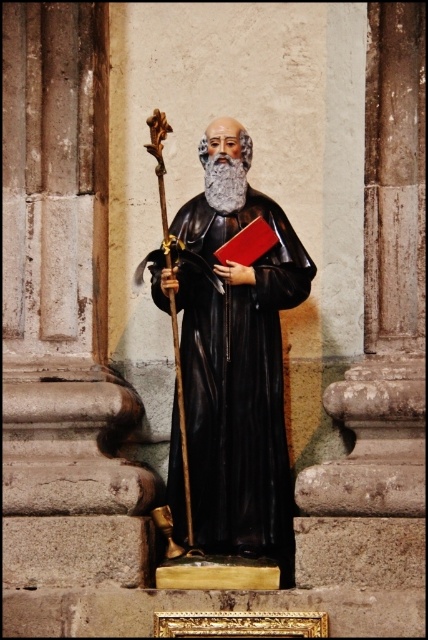
Where is `black glossy statue at center`? black glossy statue at center is located at coordinates (229, 390).

How far apart are black glossy statue at center and graywoollybeard at center?

black glossy statue at center and graywoollybeard at center are 5.21 meters apart from each other.

Does point (234, 406) lie behind point (238, 208)?

No, (234, 406) is closer to viewer.

Where is `black glossy statue at center`? black glossy statue at center is located at coordinates (229, 390).